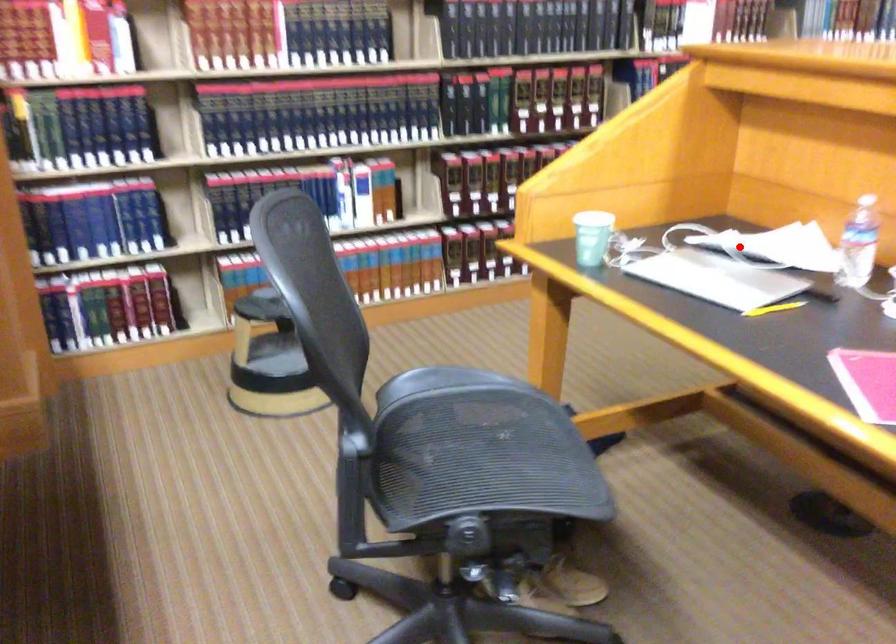
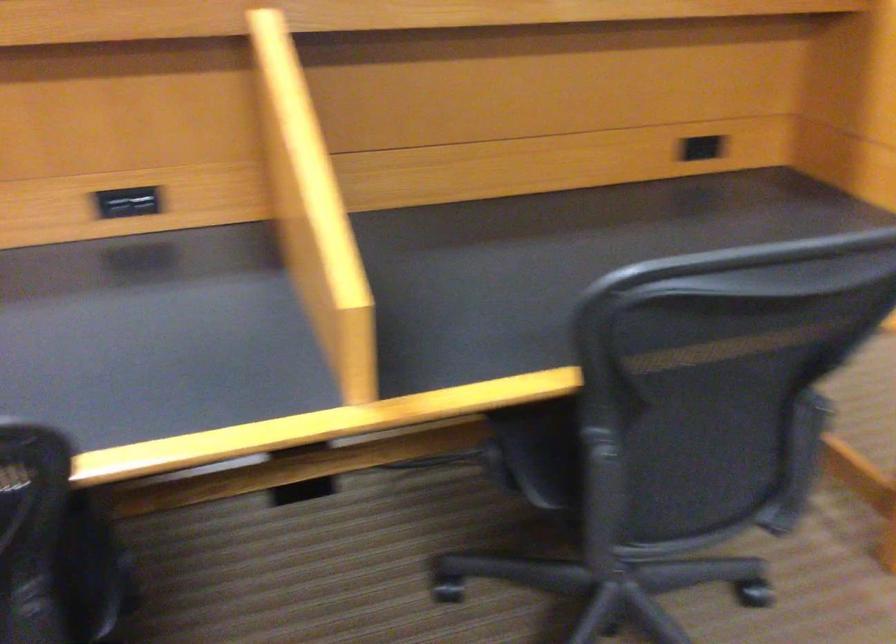
Question: I am providing you with two images of the same scene from different viewpoints. A red point is marked on the first image. Can you still see the location of the red point in image 2?

Choices:
 (A) Yes
 (B) No

Answer: (B)